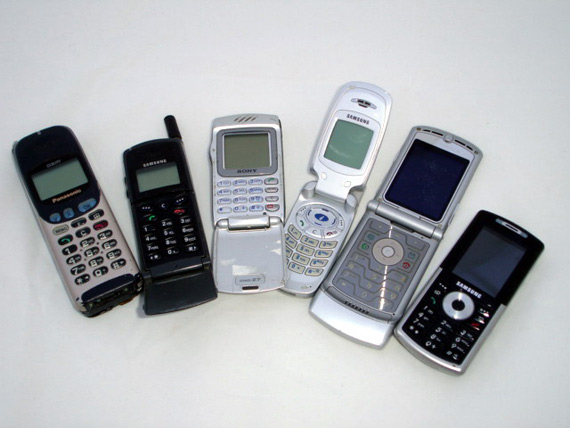
Locate an element on the screen. The height and width of the screenshot is (428, 570). phone screens is located at coordinates click(61, 181), click(158, 178), click(246, 151), click(348, 145), click(426, 180), click(491, 259).